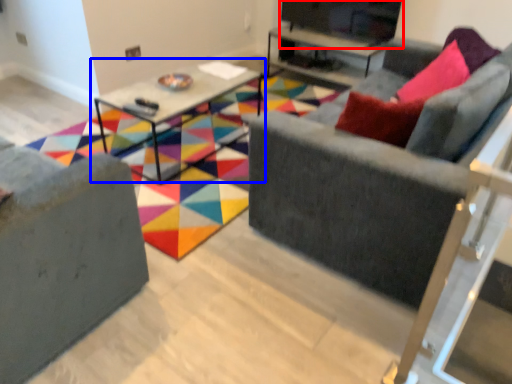
Question: Which object is closer to the camera taking this photo, entertainment center (highlighted by a red box) or table (highlighted by a blue box)?

Choices:
 (A) entertainment center
 (B) table

Answer: (B)